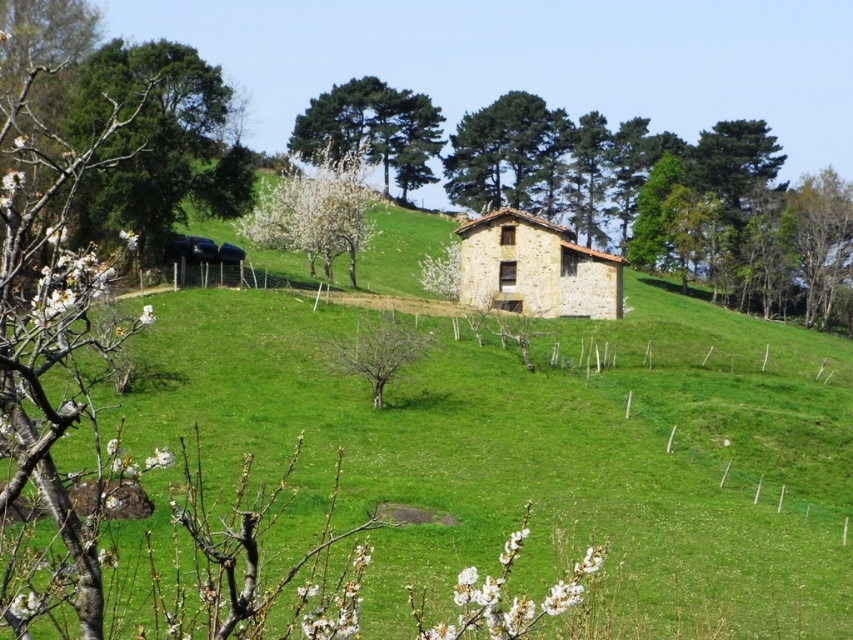
You are standing at the point marked by the coordinate point (508,154) in the image. Looking around, you see a green leafy tree at center. What direction should you face to look towards the stone house?

The point (508,154) marks the green leafy tree at center. Since the stone house is situated on a gently sloping hill, you should face uphill to look towards the stone house.

You are a bird looking for a place to perch. You see a green leafy tree at center and a bare wood tree at center. Which tree would you choose if you want to find more branches to land on?

The green leafy tree at center is bigger than the bare wood tree at center, so you should choose the green leafy tree at center because it has more branches to land on.